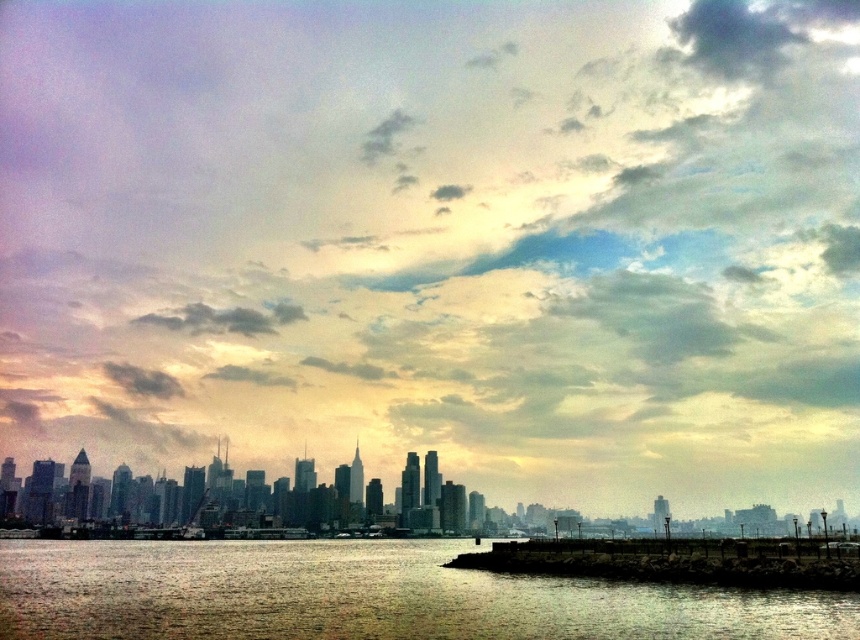
You are standing at the edge of the water in the city skyline scene. You see two points marked in the image. Which point is closer to you, point (409, 291) or point (699, 580)?

Point (699, 580) is closer to you because the description states that point (409, 291) is further to the camera than point (699, 580).

Based on the photo, you are a drone operator who needs to fly a drone from the reflective silver water at lower center to the dark gray cloud at upper center. What is the vertical distance the drone needs to cover?

The vertical distance the drone needs to cover is 287.14 meters, as the reflective silver water at lower center is 287.14 meters below the dark gray cloud at upper center.